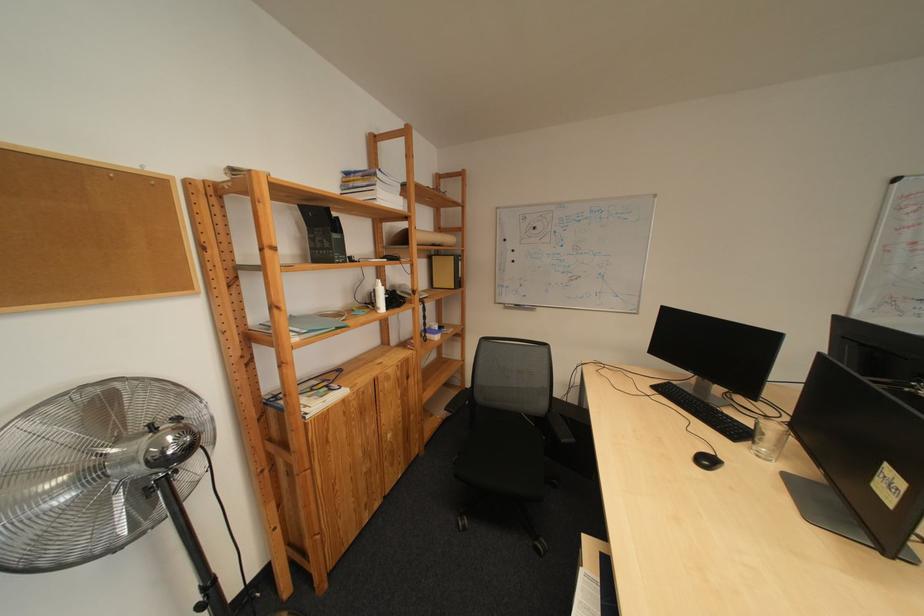
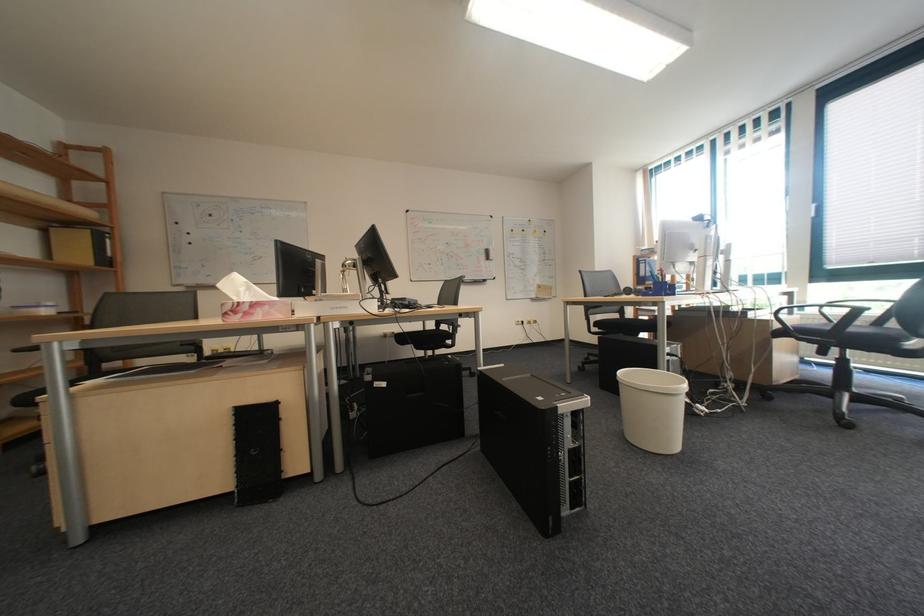
Where in the second image is the point corresponding to the point at 468,259 from the first image?

(103, 232)